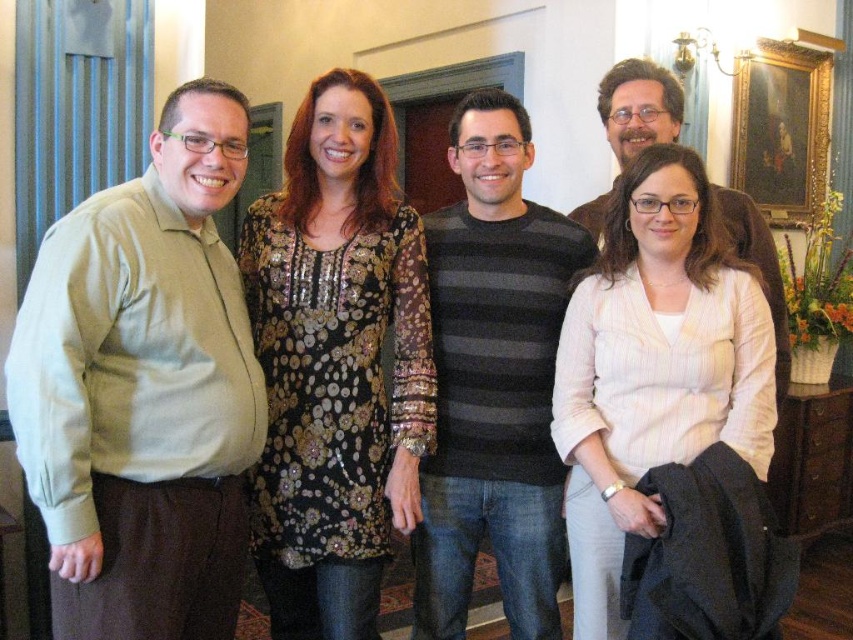
Question: Is white striped blazer at center smaller than gold-framed painting at upper right?

Choices:
 (A) no
 (B) yes

Answer: (A)

Question: Can you confirm if shiny sequined dress at center is thinner than matte brown jacket at upper right?

Choices:
 (A) yes
 (B) no

Answer: (A)

Question: Which of the following is the closest to the observer?

Choices:
 (A) white striped blazer at center
 (B) gold-framed painting at upper right

Answer: (A)

Question: Considering the real-world distances, which object is closest to the white striped blazer at center?

Choices:
 (A) gold-framed painting at upper right
 (B) light green shirt at left
 (C) striped sweater at center

Answer: (C)

Question: Which object is the farthest from the matte brown jacket at upper right?

Choices:
 (A) white striped blazer at center
 (B) shiny sequined dress at center

Answer: (B)

Question: Is white striped blazer at center bigger than gold-framed painting at upper right?

Choices:
 (A) no
 (B) yes

Answer: (B)